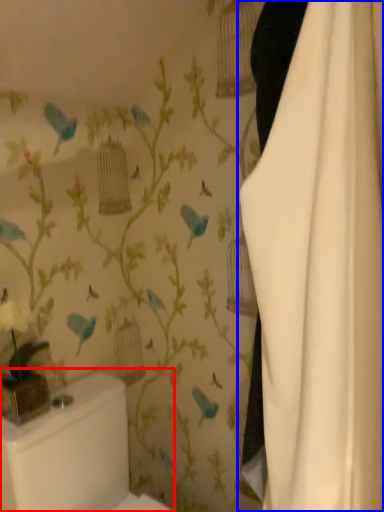
Question: Which object is closer to the camera taking this photo, toilet bowl (highlighted by a red box) or curtain (highlighted by a blue box)?

Choices:
 (A) toilet bowl
 (B) curtain

Answer: (B)